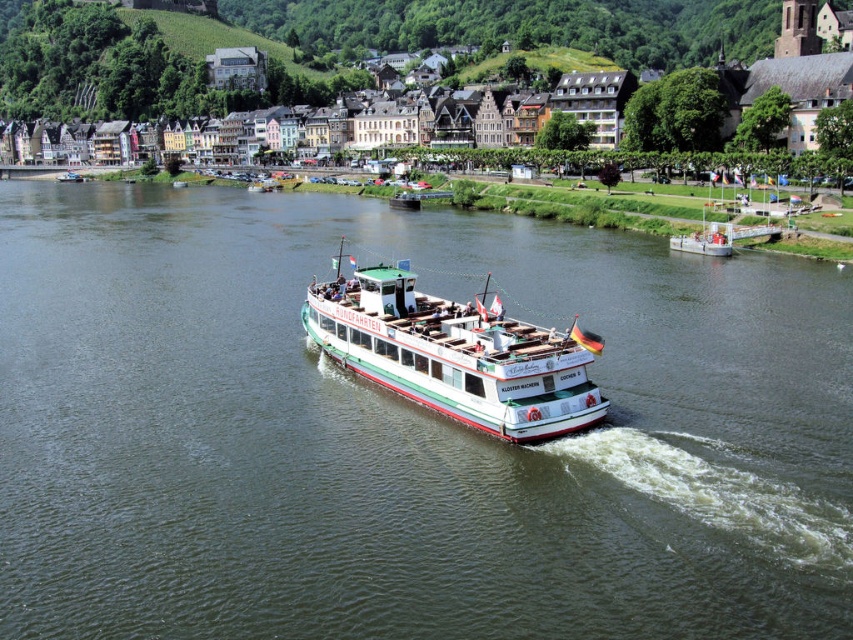
Question: From the image, what is the correct spatial relationship of pastel painted buildings at center in relation to white glossy boat at center?

Choices:
 (A) right
 (B) left

Answer: (B)

Question: Which of the following is the closest to the observer?

Choices:
 (A) 720,241
 (B) 364,44
 (C) 547,364

Answer: (C)

Question: Is white glossy ferry at center closer to the viewer compared to white glossy boat at center?

Choices:
 (A) no
 (B) yes

Answer: (B)

Question: Is pastel painted buildings at center thinner than white glossy ferry at center?

Choices:
 (A) no
 (B) yes

Answer: (A)

Question: Which object appears closest to the camera in this image?

Choices:
 (A) white glossy boat at center
 (B) pastel painted buildings at center
 (C) green matte boat at center
 (D) white glossy ferry at center

Answer: (C)

Question: Which point appears closest to the camera in this image?

Choices:
 (A) (729, 3)
 (B) (697, 236)

Answer: (B)